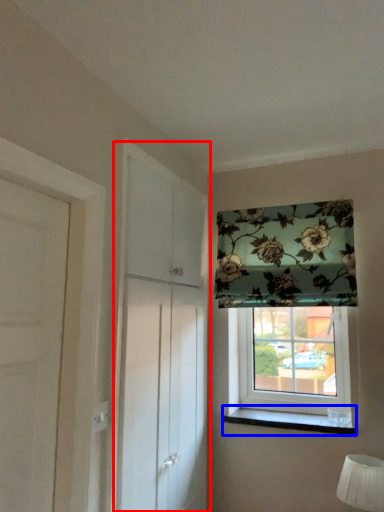
Question: Which object appears farthest to the camera in this image, screen door (highlighted by a red box) or window sill (highlighted by a blue box)?

Choices:
 (A) screen door
 (B) window sill

Answer: (B)